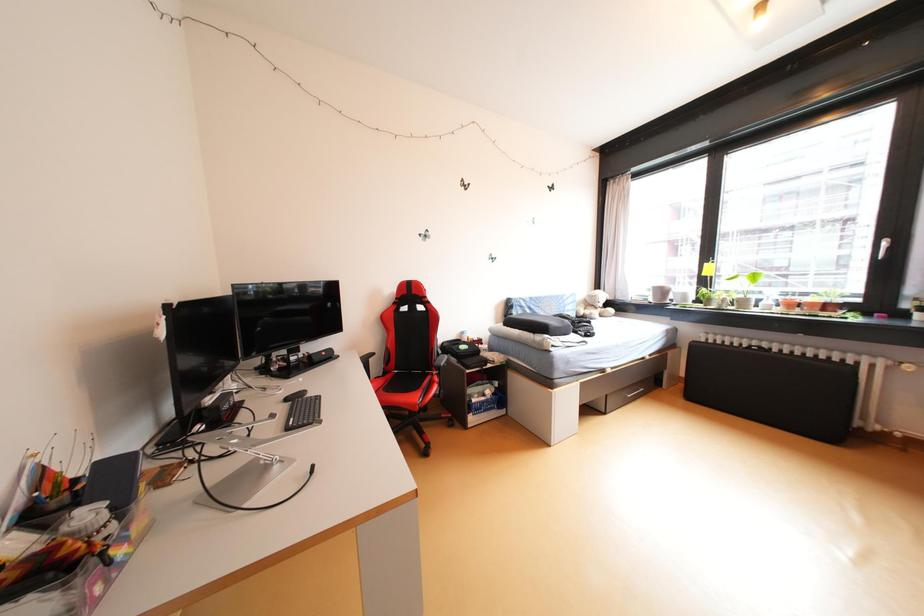
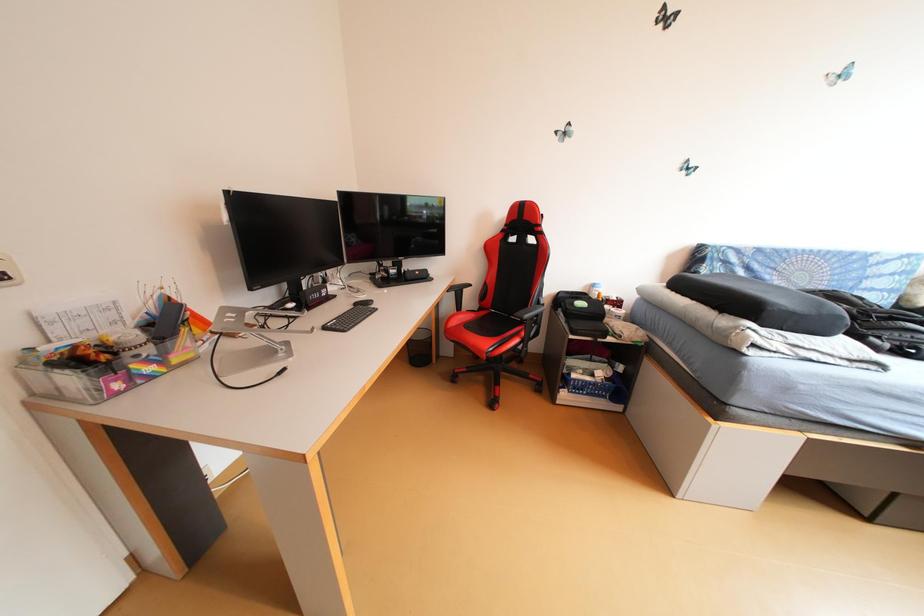
Based on the photo, the first image is from the beginning of the video and the second image is from the end. How did the camera likely rotate when shooting the video?

The rotation direction of the camera is left-down.